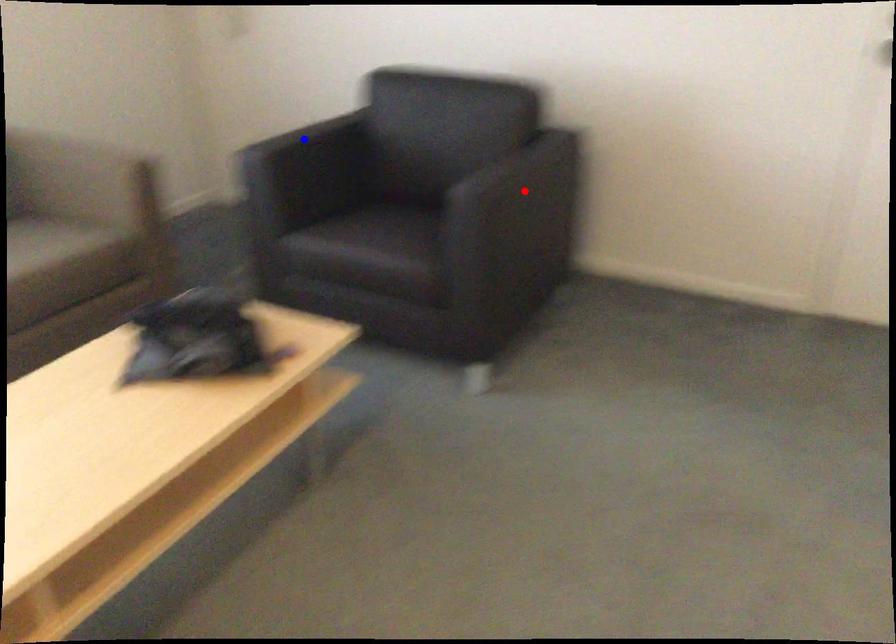
Question: In the image, two points are highlighted. Which point is nearer to the camera? Reply with the corresponding letter.

Choices:
 (A) blue point
 (B) red point

Answer: (B)